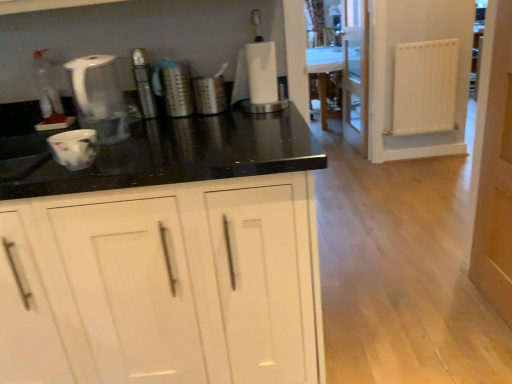
Question: Considering the relative positions of transparent glass screen door at center and white matte cabinet at center in the image provided, is transparent glass screen door at center to the right of white matte cabinet at center from the viewer's perspective?

Choices:
 (A) no
 (B) yes

Answer: (B)

Question: Considering the relative sizes of transparent glass screen door at center and white matte cabinet at center in the image provided, is transparent glass screen door at center shorter than white matte cabinet at center?

Choices:
 (A) yes
 (B) no

Answer: (B)

Question: Does transparent glass screen door at center have a larger size compared to white matte cabinet at center?

Choices:
 (A) no
 (B) yes

Answer: (A)

Question: Is transparent glass screen door at center outside of white matte cabinet at center?

Choices:
 (A) yes
 (B) no

Answer: (A)

Question: From a real-world perspective, is transparent glass screen door at center positioned over white matte cabinet at center based on gravity?

Choices:
 (A) yes
 (B) no

Answer: (A)

Question: Is wooden door at right to the left or to the right of brushed metal canisters at center, which ranks as the second appliance in left-to-right order, in the image?

Choices:
 (A) left
 (B) right

Answer: (B)

Question: From a real-world perspective, is wooden door at right positioned above or below brushed metal canisters at center, acting as the 3th appliance starting from the right?

Choices:
 (A) below
 (B) above

Answer: (A)

Question: Is point (480, 208) positioned closer to the camera than point (173, 97)?

Choices:
 (A) farther
 (B) closer

Answer: (A)

Question: From the image's perspective, is wooden door at right located above or below brushed metal canisters at center, which ranks as the second appliance in left-to-right order?

Choices:
 (A) below
 (B) above

Answer: (A)

Question: In terms of height, does white paper towel holder at center, positioned as the 4th appliance in left-to-right order, look taller or shorter compared to white matte cabinet at center?

Choices:
 (A) tall
 (B) short

Answer: (B)

Question: Relative to white matte cabinet at center, is white paper towel holder at center, positioned as the 4th appliance in left-to-right order, in front or behind?

Choices:
 (A) behind
 (B) front

Answer: (A)

Question: Based on their sizes in the image, would you say white paper towel holder at center, positioned as the 4th appliance in left-to-right order, is bigger or smaller than white matte cabinet at center?

Choices:
 (A) small
 (B) big

Answer: (A)

Question: Looking at their shapes, would you say white paper towel holder at center, which is the 1th appliance in right-to-left order, is wider or thinner than white matte cabinet at center?

Choices:
 (A) thin
 (B) wide

Answer: (A)

Question: Which is correct: white plastic kettle at upper left is inside brushed metal canister at center, acting as the 2th appliance starting from the right, or outside of it?

Choices:
 (A) outside
 (B) inside

Answer: (A)

Question: Based on their positions, is white plastic kettle at upper left located to the left or right of brushed metal canister at center, acting as the 2th appliance starting from the right?

Choices:
 (A) right
 (B) left

Answer: (B)